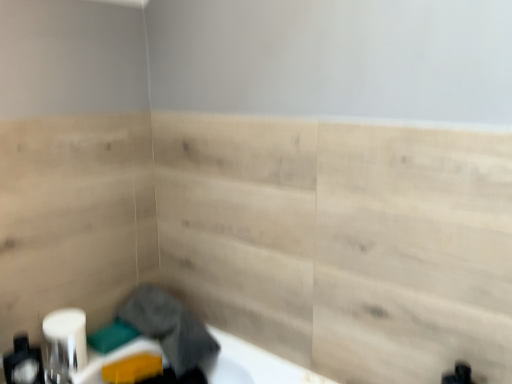
Question: From a real-world perspective, is white glossy toilet paper at lower left physically below matte white soap dispenser at lower left?

Choices:
 (A) yes
 (B) no

Answer: (A)

Question: Is white glossy toilet paper at lower left smaller than matte white soap dispenser at lower left?

Choices:
 (A) no
 (B) yes

Answer: (B)

Question: Would you say white glossy toilet paper at lower left is outside matte white soap dispenser at lower left?

Choices:
 (A) no
 (B) yes

Answer: (B)

Question: From a real-world perspective, is white glossy toilet paper at lower left over matte white soap dispenser at lower left?

Choices:
 (A) yes
 (B) no

Answer: (B)

Question: Is the depth of white glossy toilet paper at lower left less than that of matte white soap dispenser at lower left?

Choices:
 (A) no
 (B) yes

Answer: (A)

Question: Is white glossy toilet paper at lower left bigger or smaller than natural wood paneling at center?

Choices:
 (A) big
 (B) small

Answer: (B)

Question: Considering the positions of white glossy toilet paper at lower left and natural wood paneling at center in the image, is white glossy toilet paper at lower left taller or shorter than natural wood paneling at center?

Choices:
 (A) short
 (B) tall

Answer: (A)

Question: Considering their positions, is white glossy toilet paper at lower left located in front of or behind natural wood paneling at center?

Choices:
 (A) front
 (B) behind

Answer: (B)

Question: Based on their positions, is white glossy toilet paper at lower left located to the left or right of natural wood paneling at center?

Choices:
 (A) left
 (B) right

Answer: (A)

Question: Based on their positions, is gray fabric at lower left located to the left or right of natural wood paneling at center?

Choices:
 (A) left
 (B) right

Answer: (A)

Question: Considering their positions, is gray fabric at lower left located in front of or behind natural wood paneling at center?

Choices:
 (A) front
 (B) behind

Answer: (B)

Question: Is point (155, 304) positioned closer to the camera than point (397, 163)?

Choices:
 (A) closer
 (B) farther

Answer: (B)

Question: From the image's perspective, is gray fabric at lower left above or below natural wood paneling at center?

Choices:
 (A) below
 (B) above

Answer: (A)

Question: Relative to white glossy toilet paper at lower left, is matte white soap dispenser at lower left in front or behind?

Choices:
 (A) front
 (B) behind

Answer: (A)

Question: Based on their sizes in the image, would you say matte white soap dispenser at lower left is bigger or smaller than white glossy toilet paper at lower left?

Choices:
 (A) big
 (B) small

Answer: (A)